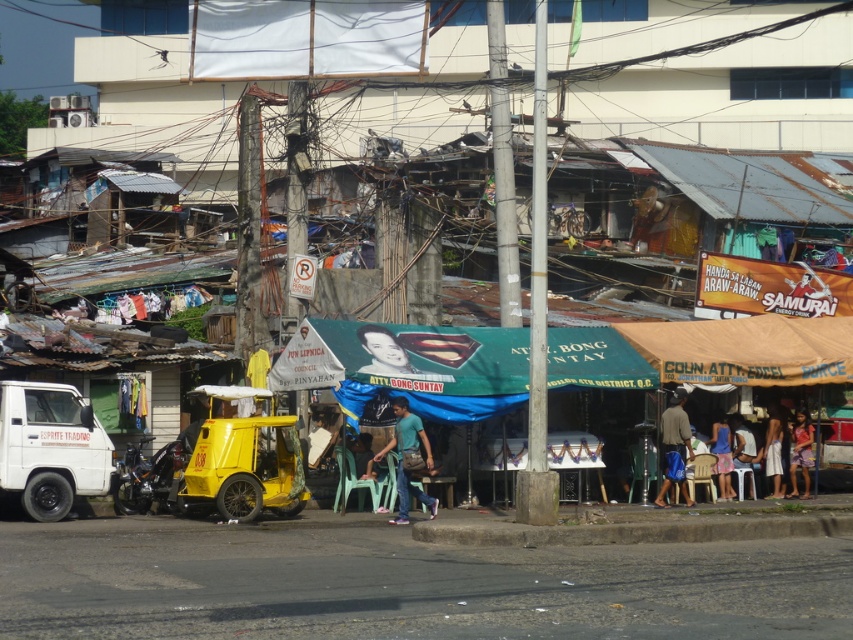
Question: Is green fabric canopy at center in front of blue fabric dress at center?

Choices:
 (A) yes
 (B) no

Answer: (A)

Question: Where is green fabric canopy at center located in relation to dark brown fabric pants at center in the image?

Choices:
 (A) left
 (B) right

Answer: (A)

Question: Which point is closer to the camera?

Choices:
 (A) blue fabric dress at center
 (B) dark brown fabric pants at center
 (C) light blue denim jeans at center
 (D) white cotton shorts at lower right

Answer: (C)

Question: Which object is positioned farthest from the green fabric canopy at center?

Choices:
 (A) light brown plastic chair at lower right
 (B) blue fabric dress at center

Answer: (A)

Question: Which of the following is the farthest from the observer?

Choices:
 (A) (796, 435)
 (B) (393, 397)

Answer: (A)

Question: Is dark brown fabric pants at center closer to camera compared to light brown plastic chair at lower right?

Choices:
 (A) no
 (B) yes

Answer: (B)